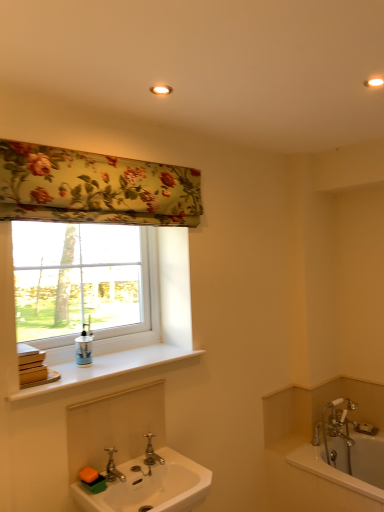
Where is `vacant area that is situated to the right of matte white recessed light at upper center`? vacant area that is situated to the right of matte white recessed light at upper center is located at coordinates (200, 89).